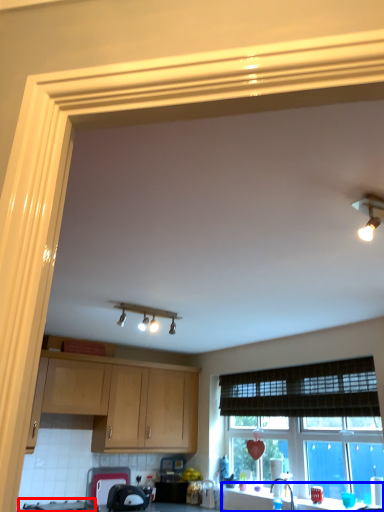
Question: Which of the following is the farthest to the observer, gas stove (highlighted by a red box) or counter top (highlighted by a blue box)?

Choices:
 (A) gas stove
 (B) counter top

Answer: (A)